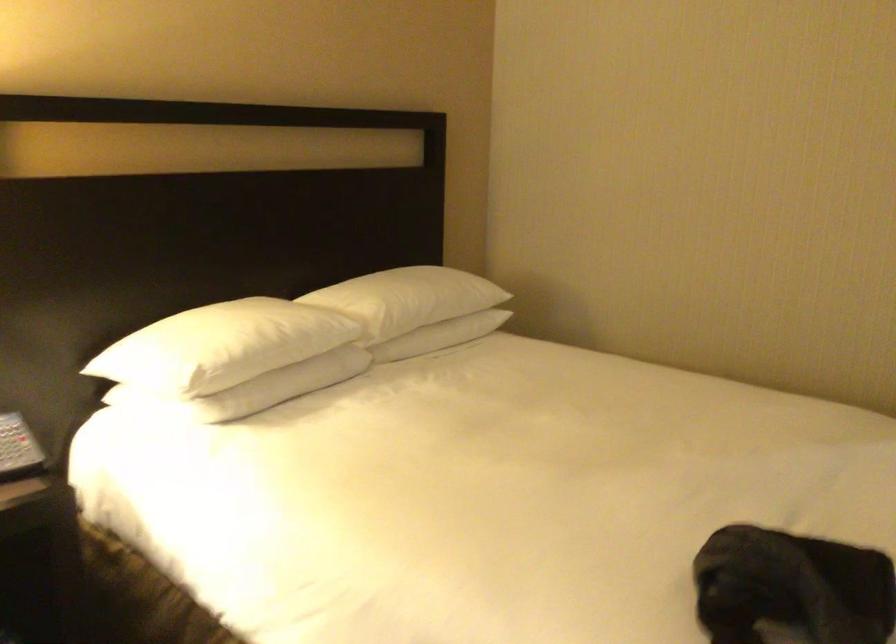
Describe the element at coordinates (19, 449) in the screenshot. The height and width of the screenshot is (644, 896). I see `a telephone handset` at that location.